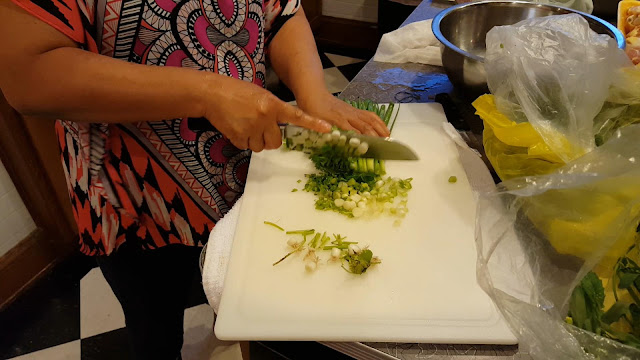
Find the location of a particular element. This screenshot has height=360, width=640. black and white diamond flooring is located at coordinates (73, 335).